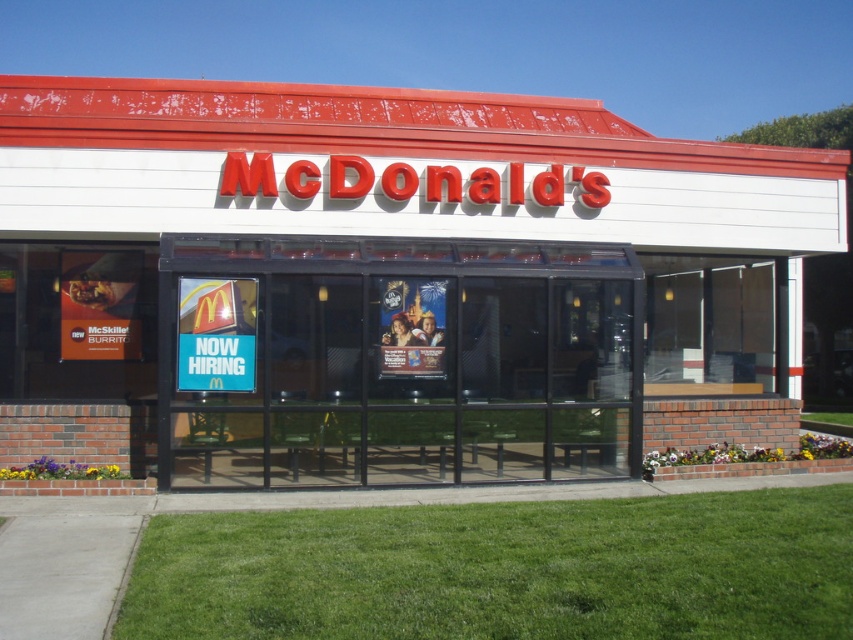
Question: Does white brick mcdonald's at center appear on the left side of transparent glass bench at center?

Choices:
 (A) yes
 (B) no

Answer: (B)

Question: Does white brick mcdonald's at center have a smaller size compared to transparent glass bench at center?

Choices:
 (A) yes
 (B) no

Answer: (B)

Question: Is white brick mcdonald's at center positioned in front of transparent glass bench at center?

Choices:
 (A) yes
 (B) no

Answer: (A)

Question: Which point appears farthest from the camera in this image?

Choices:
 (A) (509, 234)
 (B) (635, 440)

Answer: (A)

Question: Which object appears farthest from the camera in this image?

Choices:
 (A) white brick mcdonald's at center
 (B) transparent glass bench at center

Answer: (B)